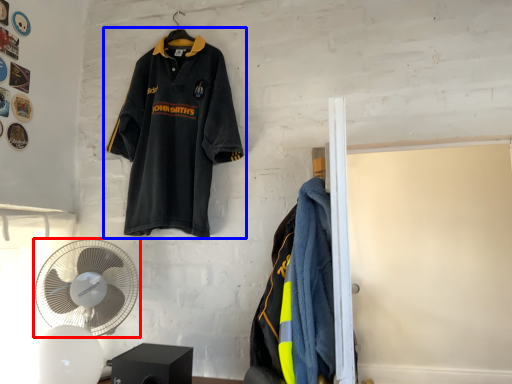
Question: Which object appears farthest to the camera in this image, mechanical fan (highlighted by a red box) or sports uniform (highlighted by a blue box)?

Choices:
 (A) mechanical fan
 (B) sports uniform

Answer: (B)